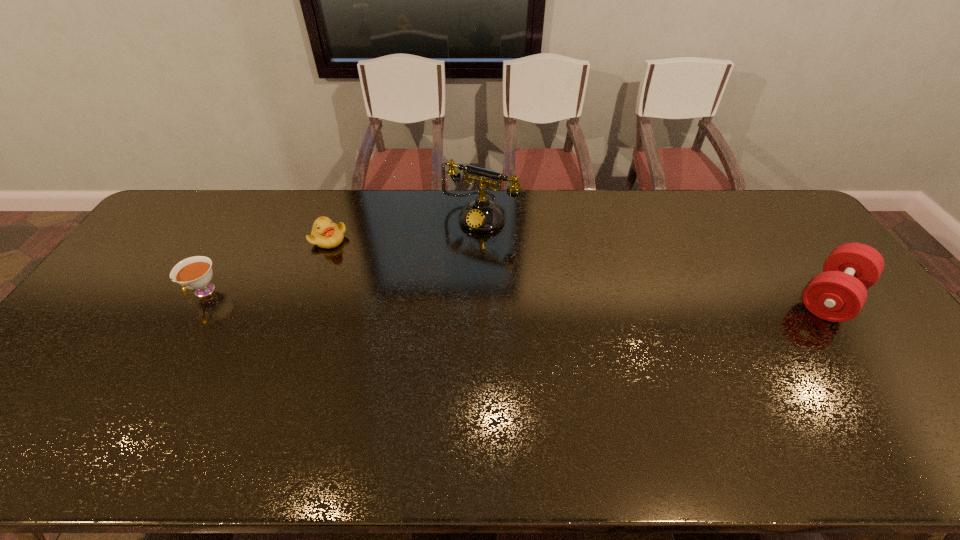
This screenshot has width=960, height=540. I want to click on vacant space located 0.290m on the dial of the tallest object, so click(420, 291).

You are a GUI agent. You are given a task and a screenshot of the screen. Output one action in this format:
    pyautogui.click(x=<x>, y=<y>)
    Task: Click on the vacant space located 0.310m on the front-facing side of the duckling
    The image size is (960, 540).
    Given the screenshot: What is the action you would take?
    pyautogui.click(x=420, y=280)

You are a GUI agent. You are given a task and a screenshot of the screen. Output one action in this format:
    pyautogui.click(x=<x>, y=<y>)
    Task: Click on the vacant area situated on the front-facing side of the duckling
    
    Given the screenshot: What is the action you would take?
    (x=422, y=282)

You are a GUI agent. You are given a task and a screenshot of the screen. Output one action in this format:
    pyautogui.click(x=<x>, y=<y>)
    Task: Click on the blank space located 0.140m on the front-facing side of the duckling
    The height and width of the screenshot is (540, 960).
    Given the screenshot: What is the action you would take?
    pyautogui.click(x=375, y=260)

Locate an element on the screen. The width and height of the screenshot is (960, 540). telephone located at the far edge is located at coordinates (482, 215).

Image resolution: width=960 pixels, height=540 pixels. Find the location of `duckling present at the far edge`. duckling present at the far edge is located at coordinates (325, 234).

Locate an element on the screen. This screenshot has width=960, height=540. object that is at the right edge is located at coordinates (838, 294).

You are a GUI agent. You are given a task and a screenshot of the screen. Output one action in this format:
    pyautogui.click(x=<x>, y=<y>)
    Task: Click on the vacant space at the far edge
    The image size is (960, 540).
    Given the screenshot: What is the action you would take?
    pyautogui.click(x=707, y=232)

Where is `free spot at the near edge of the desktop`? free spot at the near edge of the desktop is located at coordinates (837, 401).

Where is `vacant space at the left edge of the desktop`? The image size is (960, 540). vacant space at the left edge of the desktop is located at coordinates (73, 356).